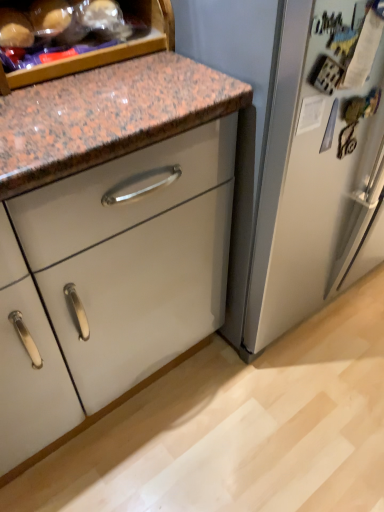
Question: Is translucent plastic bag at upper left in front of or behind white glossy cabinet at center in the image?

Choices:
 (A) behind
 (B) front

Answer: (B)

Question: In terms of height, does translucent plastic bag at upper left look taller or shorter compared to white glossy cabinet at center?

Choices:
 (A) short
 (B) tall

Answer: (B)

Question: Is point (11, 61) positioned closer to the camera than point (183, 120)?

Choices:
 (A) closer
 (B) farther

Answer: (B)

Question: From their relative heights in the image, would you say white glossy cabinet at center is taller or shorter than translucent plastic bag at upper left?

Choices:
 (A) tall
 (B) short

Answer: (B)

Question: From a real-world perspective, is white glossy cabinet at center positioned above or below translucent plastic bag at upper left?

Choices:
 (A) below
 (B) above

Answer: (A)

Question: Relative to translucent plastic bag at upper left, is white glossy cabinet at center in front or behind?

Choices:
 (A) behind
 (B) front

Answer: (A)

Question: Based on their positions, is white glossy cabinet at center located to the left or right of translucent plastic bag at upper left?

Choices:
 (A) right
 (B) left

Answer: (A)